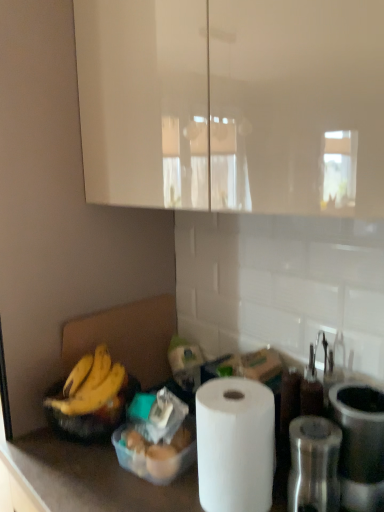
Describe the element at coordinates (90, 384) in the screenshot. I see `yellow matte bananas at lower left` at that location.

Locate an element on the screen. white matte paper towel at lower center is located at coordinates (235, 445).

Find the location of `translucent plastic container at lower center`. translucent plastic container at lower center is located at coordinates (158, 441).

Locate an element on the screen. This screenshot has height=512, width=384. metallic silver canister at right, which ranks as the 1th appliance in right-to-left order is located at coordinates (360, 445).

From the image's perspective, is white matte paper towel at lower center above or below metallic silver grinder at right, which is the second appliance from right to left?

white matte paper towel at lower center is above metallic silver grinder at right, which is the second appliance from right to left.

Which is nearer, (227,506) or (319,475)?

Positioned in front is point (319,475).

From a real-world perspective, is white matte paper towel at lower center on top of metallic silver grinder at right, placed as the 1th appliance when sorted from left to right?

Indeed, from a real-world perspective, white matte paper towel at lower center stands above metallic silver grinder at right, placed as the 1th appliance when sorted from left to right.

From the image's perspective, is yellow matte bananas at lower left located beneath white matte paper towel at lower center?

No.

Does yellow matte bananas at lower left come in front of white matte paper towel at lower center?

No, it is not.

From the picture: Looking at their sizes, would you say yellow matte bananas at lower left is wider or thinner than white matte paper towel at lower center?

Clearly, yellow matte bananas at lower left has more width compared to white matte paper towel at lower center.

Between point (92, 395) and point (249, 496), which one is positioned behind?

The point (92, 395) is farther.

Which of these two, metallic silver canister at right, which ranks as the 1th appliance in right-to-left order, or yellow matte bananas at lower left, is wider?

Wider between the two is yellow matte bananas at lower left.

Are metallic silver canister at right, which ranks as the 1th appliance in right-to-left order, and yellow matte bananas at lower left making contact?

No, metallic silver canister at right, which ranks as the 1th appliance in right-to-left order, is not beside yellow matte bananas at lower left.

Who is bigger, metallic silver canister at right, which ranks as the 1th appliance in right-to-left order, or yellow matte bananas at lower left?

Bigger between the two is metallic silver canister at right, which ranks as the 1th appliance in right-to-left order.

From the picture: Is metallic silver canister at right, which ranks as the 1th appliance in right-to-left order, inside or outside of yellow matte bananas at lower left?

metallic silver canister at right, which ranks as the 1th appliance in right-to-left order, exists outside the volume of yellow matte bananas at lower left.

How distant is translucent plastic container at lower center from yellow matte bananas at lower left?

They are 15.40 centimeters apart.

Is point (120, 448) positioned behind point (100, 383)?

No.

Can you confirm if translucent plastic container at lower center is smaller than yellow matte bananas at lower left?

Incorrect, translucent plastic container at lower center is not smaller in size than yellow matte bananas at lower left.

Looking at their sizes, would you say metallic silver grinder at right, placed as the 1th appliance when sorted from left to right, is wider or thinner than translucent plastic container at lower center?

Clearly, metallic silver grinder at right, placed as the 1th appliance when sorted from left to right, has less width compared to translucent plastic container at lower center.

Which is behind, metallic silver grinder at right, which is the second appliance from right to left, or translucent plastic container at lower center?

translucent plastic container at lower center is more distant.

Is metallic silver grinder at right, which is the second appliance from right to left, to the left or to the right of translucent plastic container at lower center in the image?

metallic silver grinder at right, which is the second appliance from right to left, is to the right of translucent plastic container at lower center.

Consider the image. Which of these two, metallic silver grinder at right, which is the second appliance from right to left, or translucent plastic container at lower center, stands taller?

Standing taller between the two is metallic silver grinder at right, which is the second appliance from right to left.

Based on the photo, between white matte paper towel at lower center and yellow matte bananas at lower left, which one has more height?

Standing taller between the two is white matte paper towel at lower center.

Is white matte paper towel at lower center turned away from yellow matte bananas at lower left?

That's not correct — white matte paper towel at lower center is not looking away from yellow matte bananas at lower left.

Which point is more forward, (x=217, y=398) or (x=67, y=411)?

Point (x=217, y=398)

Is white matte paper towel at lower center at the left side of yellow matte bananas at lower left?

No, white matte paper towel at lower center is not to the left of yellow matte bananas at lower left.

Looking at this image, how distant is translucent plastic container at lower center from metallic silver canister at right, which ranks as the 1th appliance in right-to-left order?

translucent plastic container at lower center and metallic silver canister at right, which ranks as the 1th appliance in right-to-left order, are 15.35 inches apart from each other.

From the image's perspective, is translucent plastic container at lower center beneath metallic silver canister at right, which ranks as the 1th appliance in right-to-left order?

Yes, from the image's perspective, translucent plastic container at lower center is beneath metallic silver canister at right, which ranks as the 1th appliance in right-to-left order.

From a real-world perspective, who is located lower, translucent plastic container at lower center or metallic silver canister at right, the second appliance when ordered from left to right?

translucent plastic container at lower center, from a real-world perspective.

The width and height of the screenshot is (384, 512). I want to click on paper towel that appears above the metallic silver grinder at right, placed as the 1th appliance when sorted from left to right (from the image's perspective), so click(235, 445).

Locate an element on the screen. Image resolution: width=384 pixels, height=512 pixels. paper towel that appears in front of the yellow matte bananas at lower left is located at coordinates (235, 445).

From the image, which object appears to be farther from metallic silver grinder at right, placed as the 1th appliance when sorted from left to right, translucent plastic container at lower center or metallic silver canister at right, which ranks as the 1th appliance in right-to-left order?

The object further to metallic silver grinder at right, placed as the 1th appliance when sorted from left to right, is translucent plastic container at lower center.

Looking at the image, which one is located further to translucent plastic container at lower center, metallic silver grinder at right, placed as the 1th appliance when sorted from left to right, or yellow matte bananas at lower left?

Among the two, metallic silver grinder at right, placed as the 1th appliance when sorted from left to right, is located further to translucent plastic container at lower center.

Which object lies further to the anchor point yellow matte bananas at lower left, metallic silver canister at right, the second appliance when ordered from left to right, or metallic silver grinder at right, which is the second appliance from right to left?

Based on the image, metallic silver canister at right, the second appliance when ordered from left to right, appears to be further to yellow matte bananas at lower left.

From the image, which object appears to be nearer to metallic silver grinder at right, which is the second appliance from right to left, yellow matte bananas at lower left or metallic silver canister at right, the second appliance when ordered from left to right?

Among the two, metallic silver canister at right, the second appliance when ordered from left to right, is located nearer to metallic silver grinder at right, which is the second appliance from right to left.

Based on their spatial positions, is yellow matte bananas at lower left or white matte paper towel at lower center further from metallic silver canister at right, the second appliance when ordered from left to right?

yellow matte bananas at lower left lies further to metallic silver canister at right, the second appliance when ordered from left to right, than the other object.

When comparing their distances from yellow matte bananas at lower left, does translucent plastic container at lower center or metallic silver canister at right, which ranks as the 1th appliance in right-to-left order, seem closer?

translucent plastic container at lower center is positioned closer to the anchor yellow matte bananas at lower left.

Based on their spatial positions, is metallic silver canister at right, which ranks as the 1th appliance in right-to-left order, or yellow matte bananas at lower left closer to metallic silver grinder at right, placed as the 1th appliance when sorted from left to right?

Among the two, metallic silver canister at right, which ranks as the 1th appliance in right-to-left order, is located nearer to metallic silver grinder at right, placed as the 1th appliance when sorted from left to right.

Based on their spatial positions, is white matte paper towel at lower center or metallic silver grinder at right, which is the second appliance from right to left, further from metallic silver canister at right, the second appliance when ordered from left to right?

white matte paper towel at lower center.

You are a GUI agent. You are given a task and a screenshot of the screen. Output one action in this format:
    pyautogui.click(x=<x>, y=<y>)
    Task: Click on the food located between yellow matte bananas at lower left and metallic silver grinder at right, placed as the 1th appliance when sorted from left to right, in the left-right direction
    The image size is (384, 512).
    Given the screenshot: What is the action you would take?
    pyautogui.click(x=158, y=441)

Locate an element on the screen. This screenshot has width=384, height=512. paper towel between yellow matte bananas at lower left and metallic silver grinder at right, placed as the 1th appliance when sorted from left to right, in the horizontal direction is located at coordinates (235, 445).

Where is `food situated between yellow matte bananas at lower left and white matte paper towel at lower center from left to right`? This screenshot has height=512, width=384. food situated between yellow matte bananas at lower left and white matte paper towel at lower center from left to right is located at coordinates (158, 441).

The width and height of the screenshot is (384, 512). In order to click on paper towel situated between translucent plastic container at lower center and metallic silver grinder at right, which is the second appliance from right to left, from left to right in this screenshot , I will do `click(235, 445)`.